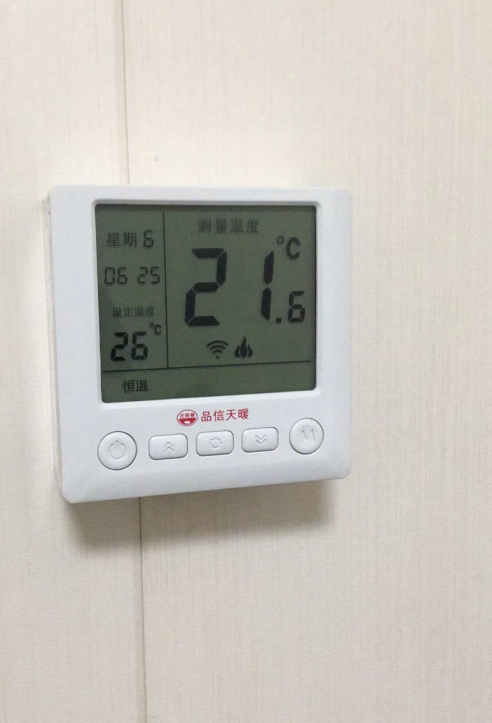
Locate an element on the screen. The width and height of the screenshot is (492, 723). wall under thermostat is located at coordinates (202, 549).